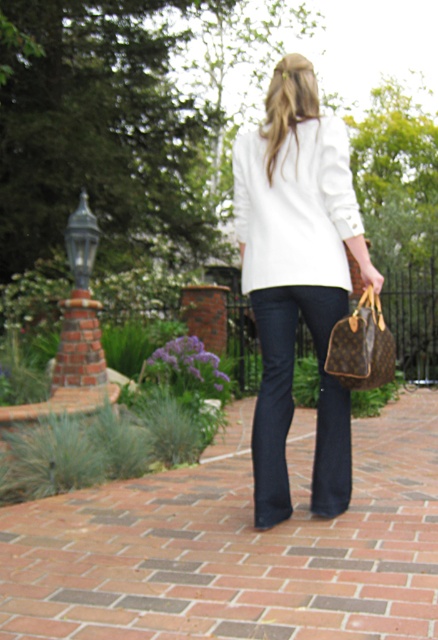
Question: Is dark blue denim jeans at center smaller than brown leather handbag at right?

Choices:
 (A) yes
 (B) no

Answer: (B)

Question: Which object is closer to the camera taking this photo?

Choices:
 (A) brick at center
 (B) white matte blazer at center
 (C) white smooth sweater at center
 (D) dark blue denim jeans at center

Answer: (A)

Question: Is dark blue denim jeans at center to the right of brown leather handbag at right from the viewer's perspective?

Choices:
 (A) no
 (B) yes

Answer: (A)

Question: Which object is closer to the camera taking this photo?

Choices:
 (A) white smooth sweater at center
 (B) brick at center
 (C) dark blue denim jeans at center

Answer: (B)

Question: Which object appears closest to the camera in this image?

Choices:
 (A) white smooth sweater at center
 (B) brick at center
 (C) dark blue denim jeans at center

Answer: (B)

Question: Does dark blue denim jeans at center appear under brown leather handbag at right?

Choices:
 (A) no
 (B) yes

Answer: (B)